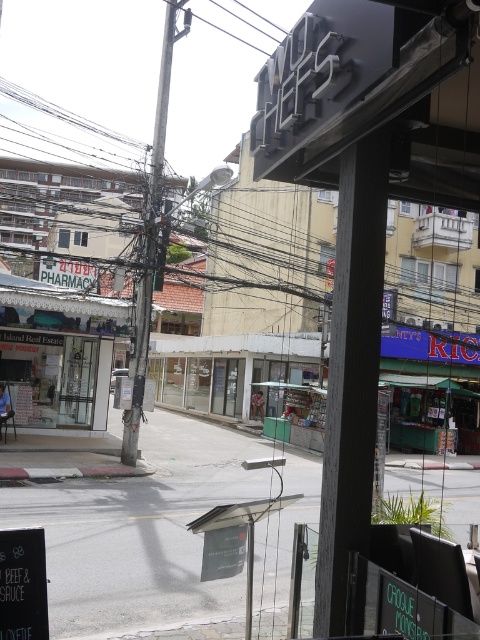
Question: Is black matte pole at center bigger than metallic gray pole at center?

Choices:
 (A) yes
 (B) no

Answer: (B)

Question: Which object is the closest to the white glass storefront at left?

Choices:
 (A) black matte pole at center
 (B) metallic gray pole at center

Answer: (B)

Question: From the image, what is the correct spatial relationship of white glass storefront at left in relation to metallic gray pole at center?

Choices:
 (A) left
 (B) right

Answer: (A)

Question: Based on their relative distances, which object is nearer to the black matte pole at center?

Choices:
 (A) white glass storefront at left
 (B) metallic gray pole at center

Answer: (B)

Question: Does white glass storefront at left appear on the right side of metallic gray pole at center?

Choices:
 (A) no
 (B) yes

Answer: (A)

Question: Which of the following is the closest to the observer?

Choices:
 (A) (9, 310)
 (B) (171, 36)
 (C) (317, 625)

Answer: (C)